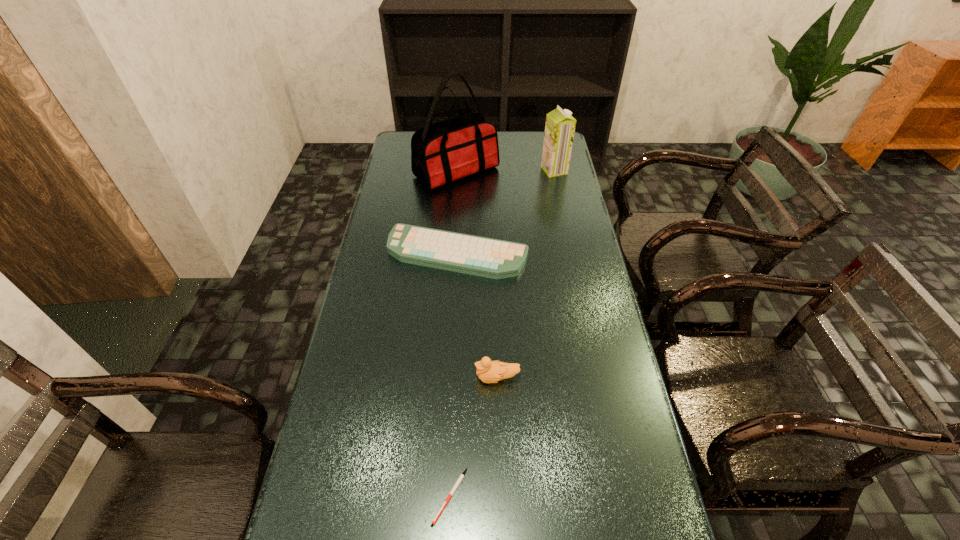
Where is `vacant space that's between the tallest object and the pen`? vacant space that's between the tallest object and the pen is located at coordinates (453, 334).

Locate an element on the screen. The height and width of the screenshot is (540, 960). object that is the third closest to the third nearest object is located at coordinates (560, 126).

This screenshot has width=960, height=540. Find the location of `the fourth closest object to the tallest object`. the fourth closest object to the tallest object is located at coordinates (460, 478).

The width and height of the screenshot is (960, 540). Find the location of `blank area in the image that satisfies the following two spatial constraints: 1. on the back side of the rightmost object; 2. on the left side of the duffel bag`. blank area in the image that satisfies the following two spatial constraints: 1. on the back side of the rightmost object; 2. on the left side of the duffel bag is located at coordinates (456, 170).